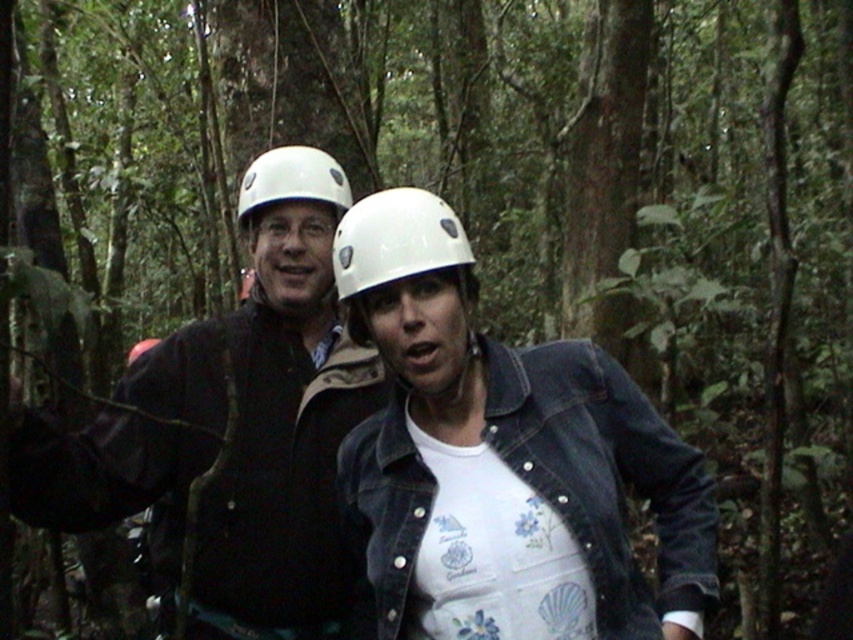
Question: Can you confirm if white matte helmet at center is bigger than white matte helmet at upper center?

Choices:
 (A) no
 (B) yes

Answer: (B)

Question: From the image, what is the correct spatial relationship of denim jacket at center in relation to matte black jacket at center?

Choices:
 (A) below
 (B) above

Answer: (A)

Question: Which object is the closest to the white matte helmet at upper center?

Choices:
 (A) matte black jacket at center
 (B) denim jacket at center
 (C) white matte helmet at center

Answer: (C)

Question: Is white matte helmet at center thinner than white matte helmet at upper center?

Choices:
 (A) no
 (B) yes

Answer: (A)

Question: Which object appears closest to the camera in this image?

Choices:
 (A) white matte helmet at center
 (B) matte black jacket at center
 (C) white matte helmet at upper center

Answer: (A)

Question: Which of the following is the farthest from the observer?

Choices:
 (A) (434, 440)
 (B) (344, 188)
 (C) (375, 230)

Answer: (B)